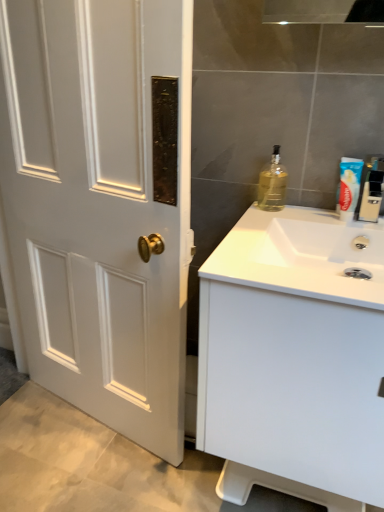
Question: From the image's perspective, relative to white matte cabinet at right, is blue plastic toothpaste at upper right above or below?

Choices:
 (A) below
 (B) above

Answer: (B)

Question: In terms of size, does blue plastic toothpaste at upper right appear bigger or smaller than white matte cabinet at right?

Choices:
 (A) small
 (B) big

Answer: (A)

Question: Estimate the real-world distances between objects in this image. Which object is closer to the clear plastic toothpaste tube at upper right, marked as the first bottle in a right-to-left arrangement?

Choices:
 (A) translucent glass bottle at upper right, the second bottle in the right-to-left sequence
 (B) white glossy sink at right
 (C) blue plastic toothpaste at upper right
 (D) white matte cabinet at right

Answer: (C)

Question: Which is farther from the white glossy sink at right?

Choices:
 (A) clear plastic toothpaste tube at upper right, which appears as the second bottle when viewed from the left
 (B) white matte cabinet at right
 (C) blue plastic toothpaste at upper right
 (D) translucent glass bottle at upper right, the second bottle in the right-to-left sequence

Answer: (D)